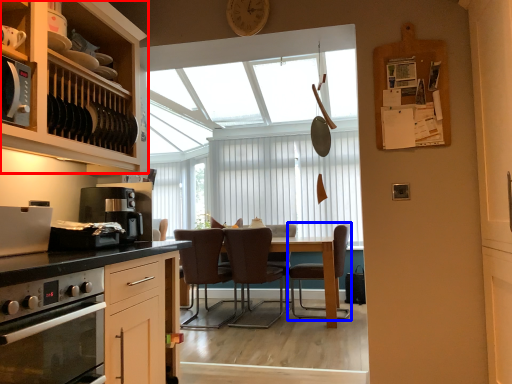
Question: Among these objects, which one is farthest to the camera, cabinetry (highlighted by a red box) or chair (highlighted by a blue box)?

Choices:
 (A) cabinetry
 (B) chair

Answer: (B)